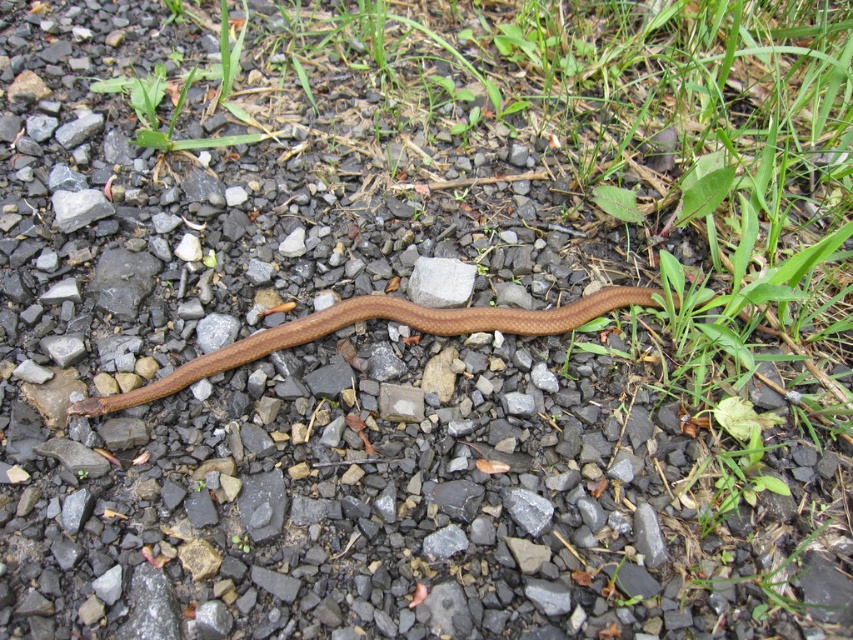
Based on the photo, you are a hiker trying to locate two points marked in the image. The first point is at coordinate point (566,305) and the second point is at coordinate point (436,275). Based on the scene description, which point is closer to the snake?

Point (566,305) is in front of point (436,275), so it is closer to the snake.

You are a hiker who spots the brown matte snake at center and the gray smooth rock at center in the image. Which object is positioned lower in the scene?

The brown matte snake at center is located below the gray smooth rock at center, so it is positioned lower in the scene.

You are a wildlife photographer aiming to capture a closeup shot of the brown matte snake at center and the gray smooth rock at center. Your camera has a maximum focus range of 6 inches. Can you focus on both subjects at the same time?

The distance between the brown matte snake at center and the gray smooth rock at center is 6.61 inches. Since the camera can only focus within 6 inches, the subjects are slightly out of the focus range. You cannot focus on both at the same time.